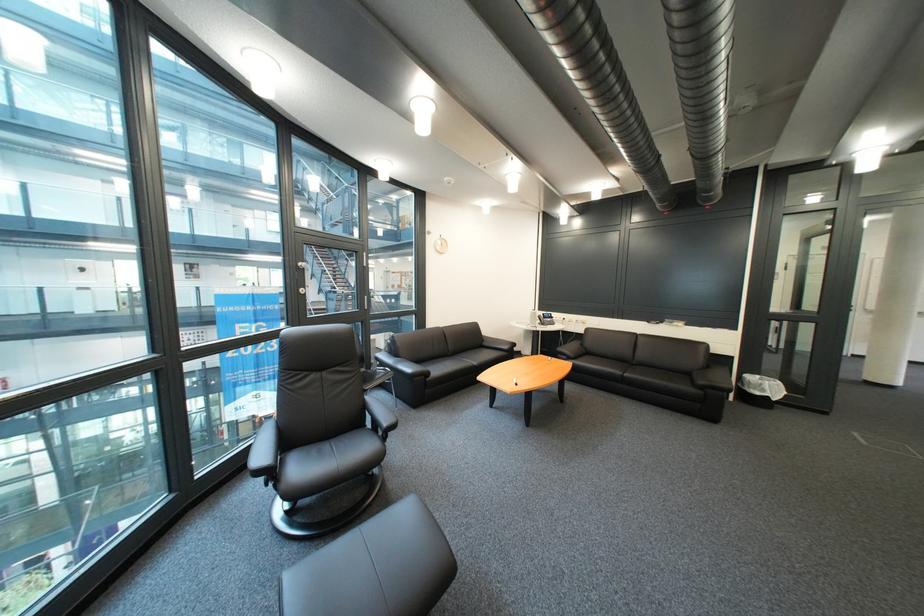
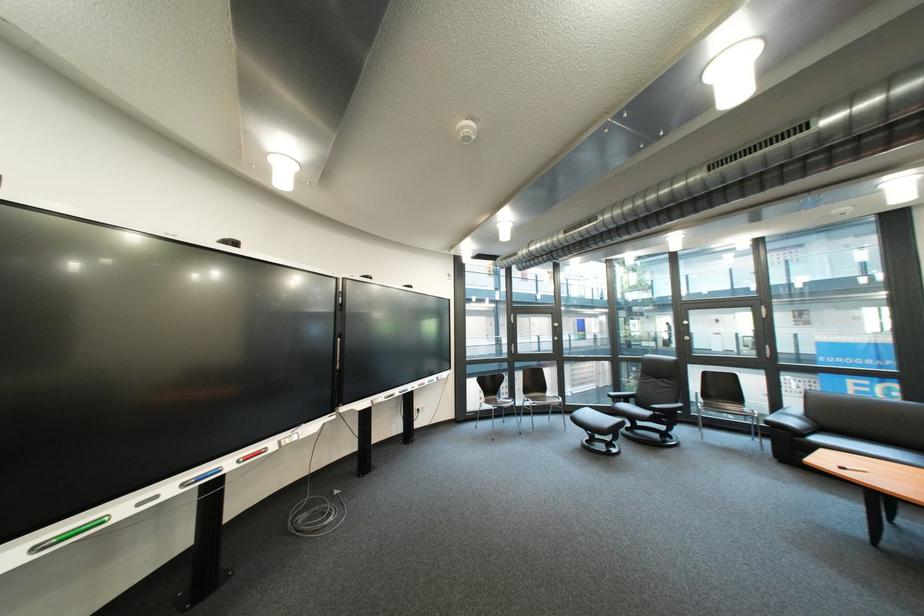
In the second image, find the point that corresponds to [529,384] in the first image.

(862, 469)